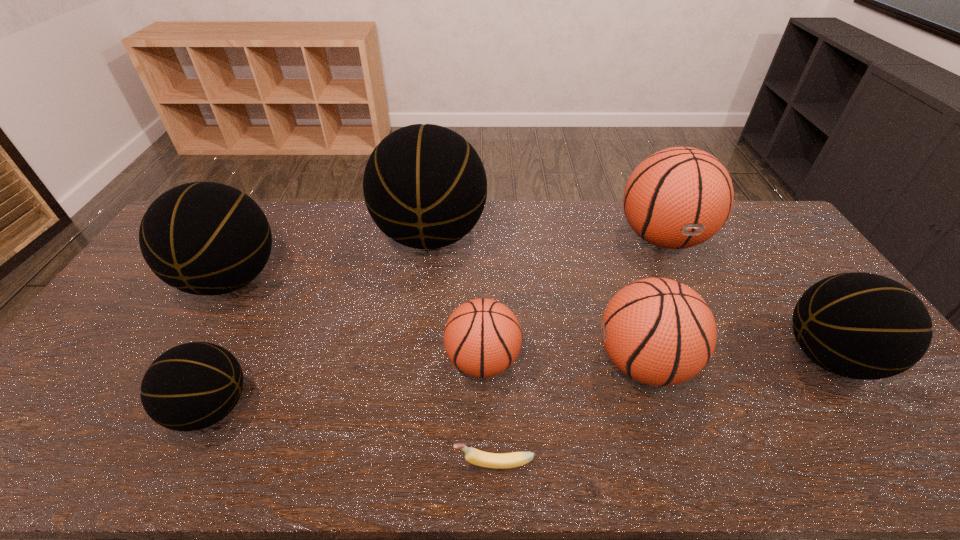
The width and height of the screenshot is (960, 540). I want to click on free space located on the side where the inflation valve is located, so click(337, 361).

Find the location of a particular element. vacant position located 0.300m on the left of the smallest black basketball is located at coordinates (49, 408).

Locate an element on the screen. The image size is (960, 540). vacant position located 0.050m at the stem of the yellow banana is located at coordinates [433, 463].

The height and width of the screenshot is (540, 960). I want to click on free spot located 0.300m at the stem of the yellow banana, so click(321, 463).

Find the location of a particular element. Image resolution: width=960 pixels, height=540 pixels. free location located 0.190m at the stem of the yellow banana is located at coordinates (370, 463).

The image size is (960, 540). I want to click on basketball situated at the near edge, so click(x=192, y=386).

Locate an element on the screen. This screenshot has height=540, width=960. banana situated at the near edge is located at coordinates (474, 456).

You are a GUI agent. You are given a task and a screenshot of the screen. Output one action in this format:
    pyautogui.click(x=<x>, y=<y>)
    Task: Click on the object that is at the left edge
    
    Given the screenshot: What is the action you would take?
    pyautogui.click(x=204, y=238)

Find the location of a particular element. object situated at the right edge is located at coordinates coord(864,326).

Where is `free space at the far edge of the desktop`? free space at the far edge of the desktop is located at coordinates (295, 222).